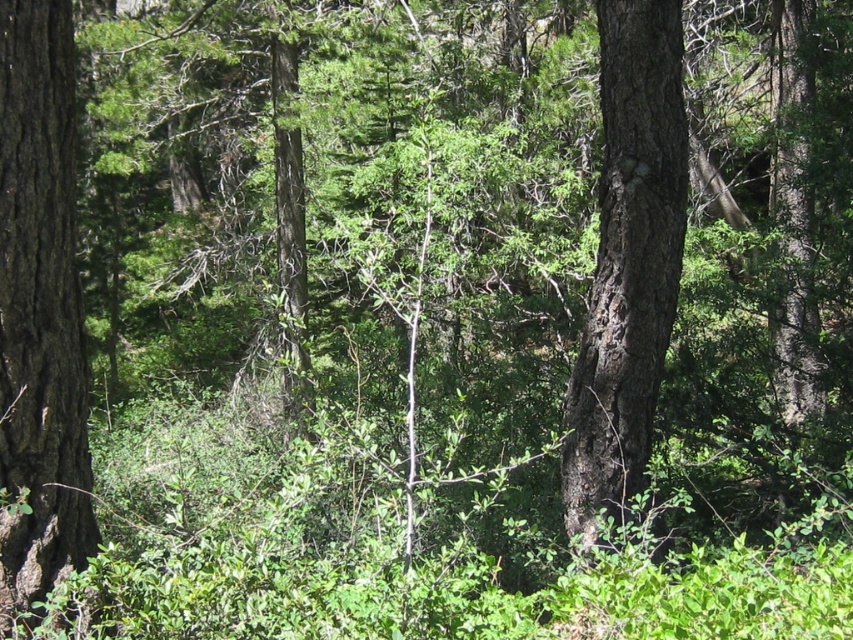
Question: Does smooth brown bark at left have a smaller size compared to dark brown bark tree at center?

Choices:
 (A) yes
 (B) no

Answer: (A)

Question: In this image, where is smooth brown bark at left located relative to dark brown bark tree at center?

Choices:
 (A) above
 (B) below

Answer: (B)

Question: Among these objects, which one is farthest from the camera?

Choices:
 (A) dark brown bark tree at center
 (B) smooth brown bark at left

Answer: (A)

Question: Does smooth brown bark at left have a lesser width compared to dark brown bark tree at center?

Choices:
 (A) no
 (B) yes

Answer: (B)

Question: Which point is closer to the camera?

Choices:
 (A) dark brown bark tree at center
 (B) smooth brown bark at left

Answer: (B)